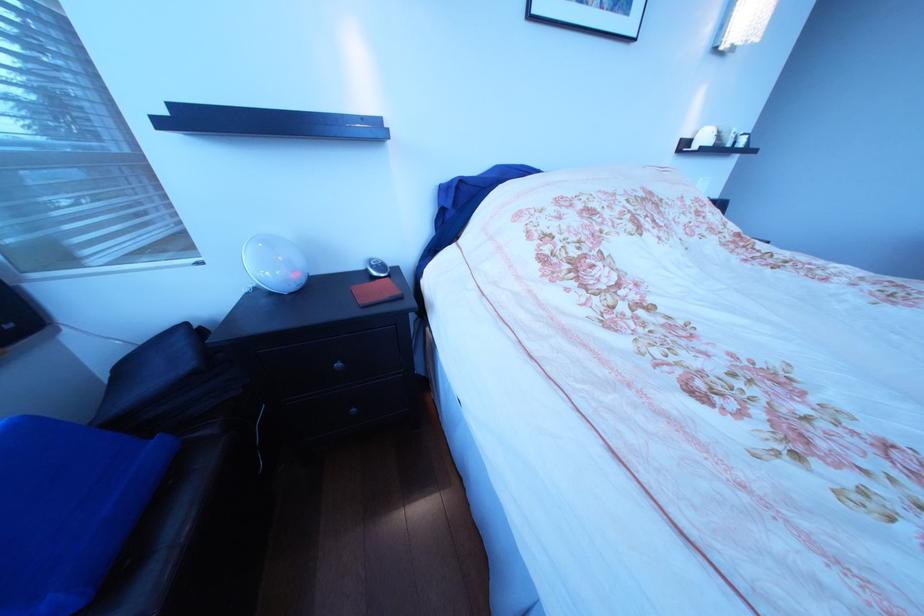
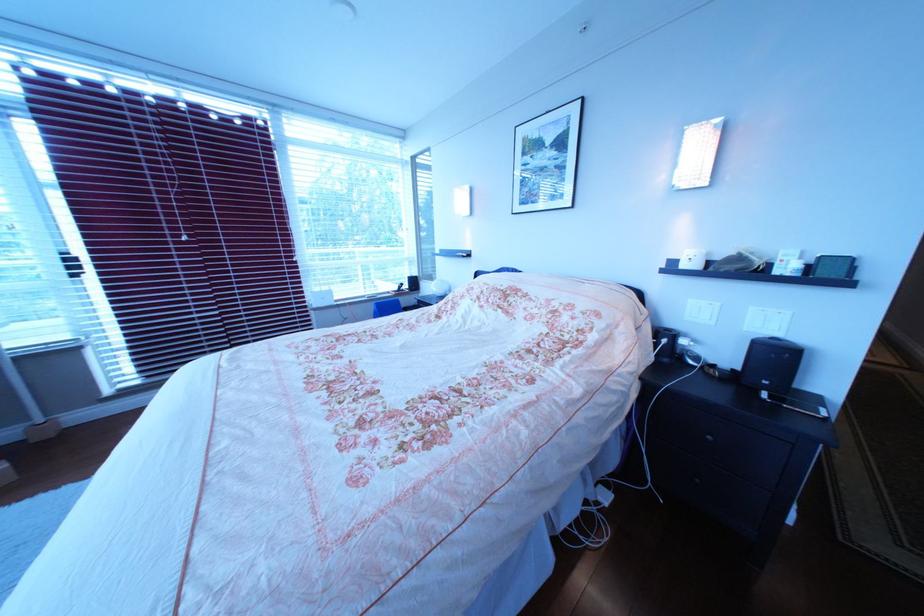
Locate, in the second image, the point that corresponds to point (716, 182) in the first image.

(767, 310)